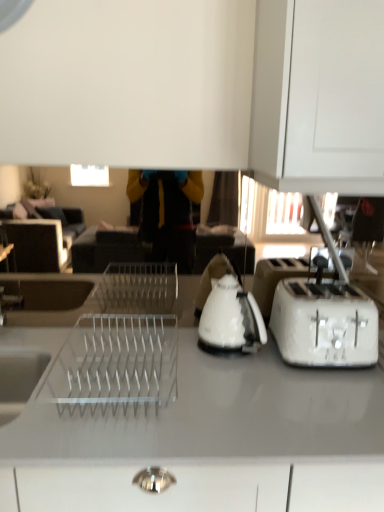
Locate an element on the screen. The width and height of the screenshot is (384, 512). space that is in front of white glossy kettle at center is located at coordinates (237, 379).